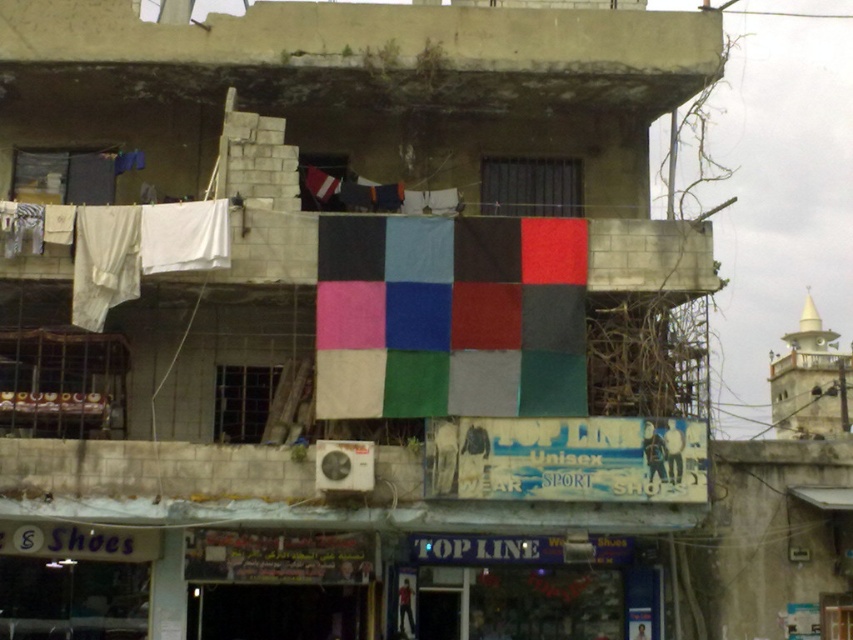
Question: Is textile flag at center wider than matte fabric flag at upper center?

Choices:
 (A) no
 (B) yes

Answer: (A)

Question: Is textile flag at center above matte fabric flag at upper center?

Choices:
 (A) yes
 (B) no

Answer: (B)

Question: Is textile flag at center above matte fabric flag at upper center?

Choices:
 (A) no
 (B) yes

Answer: (A)